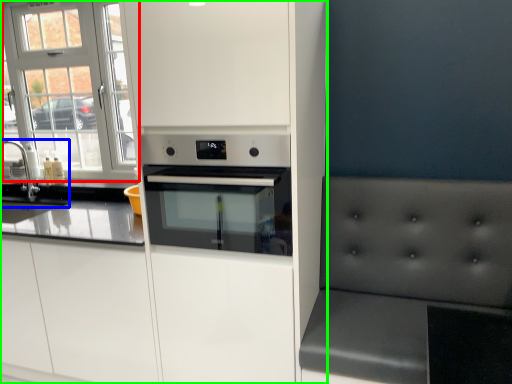
Question: Estimate the real-world distances between objects in this image. Which object is closer to window (highlighted by a red box), sink (highlighted by a blue box) or cabinetry (highlighted by a green box)?

Choices:
 (A) sink
 (B) cabinetry

Answer: (A)